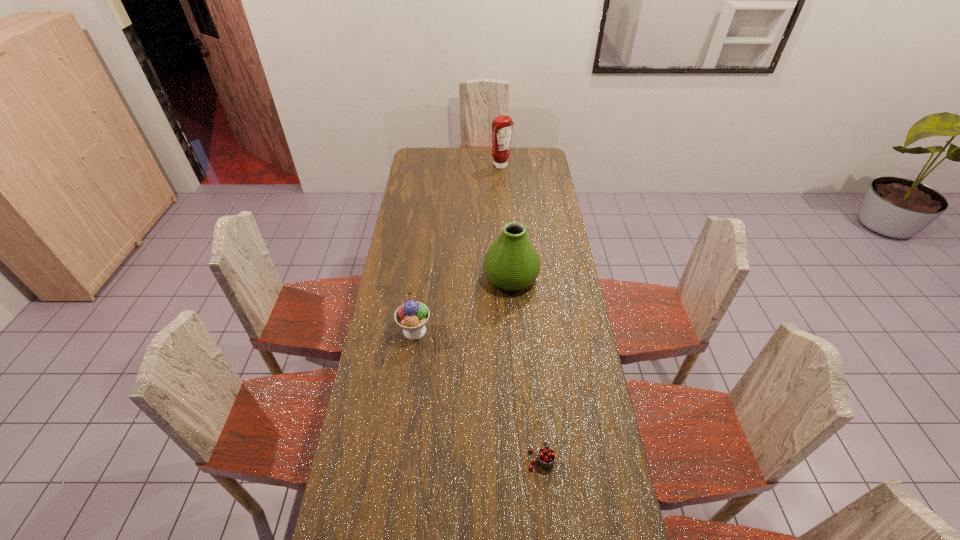
The width and height of the screenshot is (960, 540). In order to click on vacant region located on the handle side of the cherry in this screenshot , I will do `click(531, 354)`.

This screenshot has height=540, width=960. Identify the location of vacant space located on the handle side of the cherry. click(533, 373).

Find the location of a particular element. object present at the far edge is located at coordinates (502, 126).

You are a GUI agent. You are given a task and a screenshot of the screen. Output one action in this format:
    pyautogui.click(x=<x>, y=<y>)
    Task: Click on the object at the left edge
    Image resolution: width=960 pixels, height=540 pixels.
    Given the screenshot: What is the action you would take?
    pyautogui.click(x=412, y=316)

The image size is (960, 540). What are the coordinates of `object situated at the right edge` in the screenshot? It's located at (511, 263).

Where is `vacant space at the left edge`? The image size is (960, 540). vacant space at the left edge is located at coordinates (397, 337).

In the image, there is a desktop. Identify the location of vacant space at the right edge. (548, 221).

I want to click on vacant point located between the leftmost object and the second farthest object, so click(x=463, y=303).

At what (x,y) coordinates should I click in order to perform the action: click on vacant region between the vase and the icecream. Please return your answer as a coordinate pair (x, y). Image resolution: width=960 pixels, height=540 pixels. Looking at the image, I should click on (463, 303).

This screenshot has height=540, width=960. Identify the location of object that ranks as the third closest to the farthest object. (546, 455).